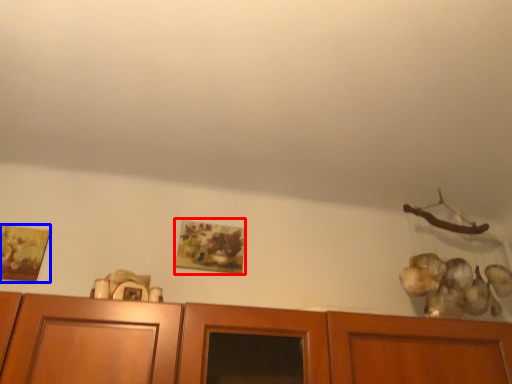
Question: Which object is closer to the camera taking this photo, picture frame (highlighted by a red box) or picture frame (highlighted by a blue box)?

Choices:
 (A) picture frame
 (B) picture frame

Answer: (B)